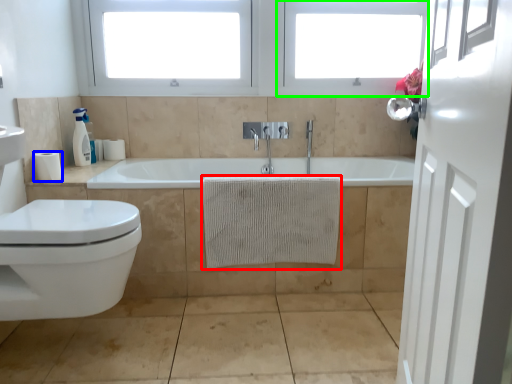
Question: Which is nearer to the bath towel (highlighted by a red box)? toilet paper (highlighted by a blue box) or window frame (highlighted by a green box).

Choices:
 (A) toilet paper
 (B) window frame

Answer: (A)